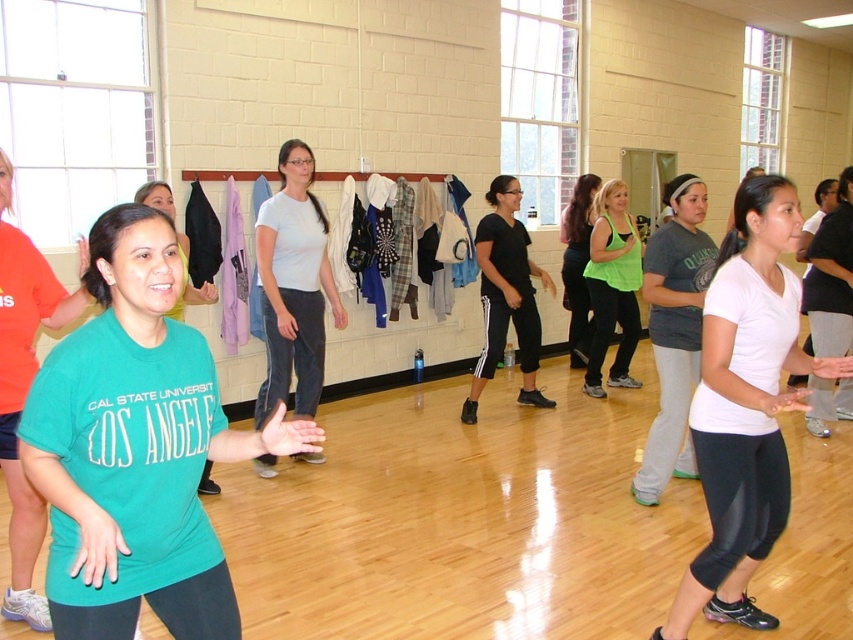
Question: Considering the real-world distances, which object is closest to the matte green t-shirt at center?

Choices:
 (A) green matte tank top at center
 (B) white matte shirt at center
 (C) green fabric tank top at center

Answer: (B)

Question: Can you confirm if green matte t-shirt at center is positioned above white matte shirt at center?

Choices:
 (A) no
 (B) yes

Answer: (B)

Question: Which object is the closest to the white cotton shirt at center?

Choices:
 (A) gray cotton t-shirt at center
 (B) matte green t-shirt at center
 (C) green fabric tank top at center

Answer: (B)

Question: Is black matte/black leggings at center positioned before green fabric tank top at center?

Choices:
 (A) no
 (B) yes

Answer: (B)

Question: Can you confirm if white matte shirt at center is positioned to the left of black matte/black leggings at center?

Choices:
 (A) yes
 (B) no

Answer: (B)

Question: Which object is closer to the camera taking this photo?

Choices:
 (A) black matte/black leggings at center
 (B) white matte shirt at center
 (C) green fabric tank top at center

Answer: (B)